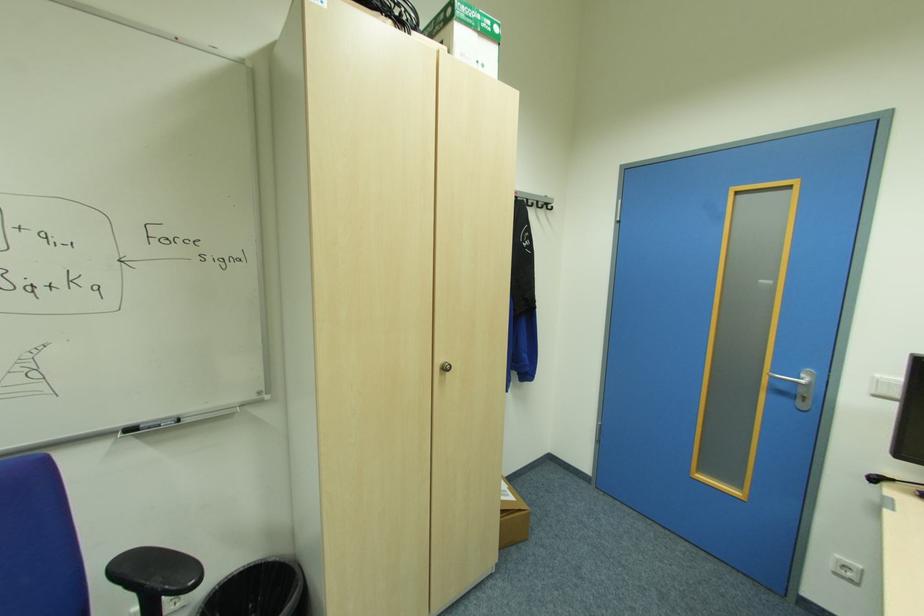
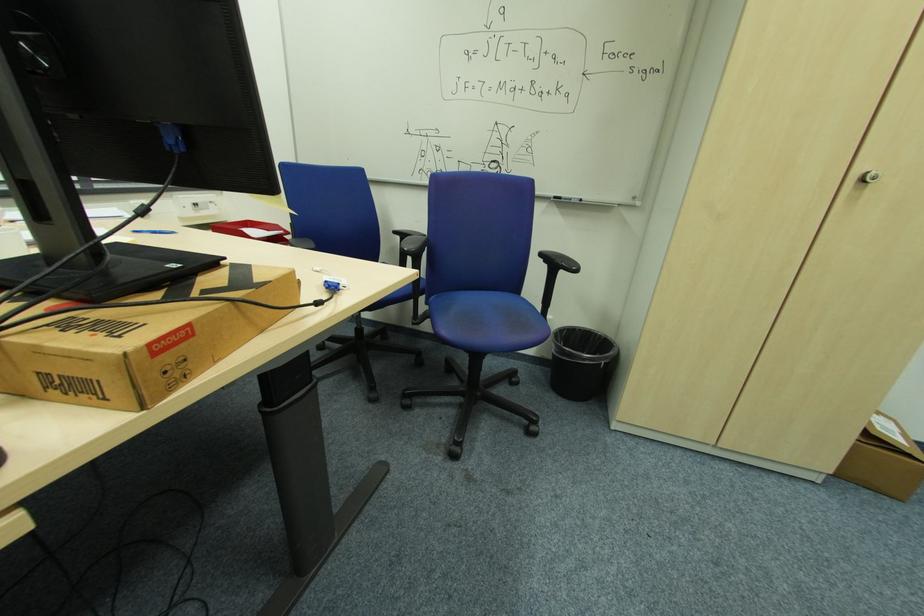
The images are taken continuously from a first-person perspective. In which direction is your viewpoint rotating?

The rotation direction of the camera is left-down.